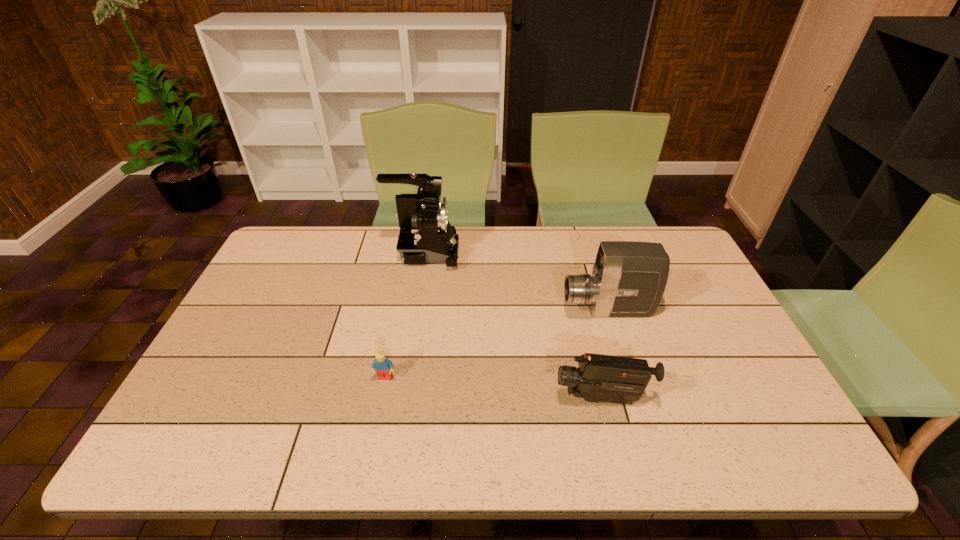
Locate an element on the screen. This screenshot has height=540, width=960. free space located 0.280m at the front of the third shortest object, highlighting the lens is located at coordinates (467, 310).

Locate an element on the screen. The height and width of the screenshot is (540, 960). free spot located 0.050m at the front of the third shortest object, highlighting the lens is located at coordinates (545, 310).

Identify the location of vacant region located 0.170m on the front-facing side of the shortest camcorder. The height and width of the screenshot is (540, 960). (485, 399).

Locate an element on the screen. free space located 0.200m on the front-facing side of the shortest camcorder is located at coordinates click(x=472, y=399).

The width and height of the screenshot is (960, 540). Find the location of `blank space located on the front-facing side of the shortest camcorder`. blank space located on the front-facing side of the shortest camcorder is located at coordinates (411, 399).

The height and width of the screenshot is (540, 960). Find the location of `free space located 0.130m on the face of the third farthest object`. free space located 0.130m on the face of the third farthest object is located at coordinates [x=374, y=429].

At what (x,y) coordinates should I click in order to perform the action: click on object that is at the far edge. Please return your answer as a coordinate pair (x, y). Image resolution: width=960 pixels, height=540 pixels. Looking at the image, I should click on (426, 236).

You are a GUI agent. You are given a task and a screenshot of the screen. Output one action in this format:
    pyautogui.click(x=<x>, y=<y>)
    Task: Click on the vacant space at the far edge
    The width and height of the screenshot is (960, 540).
    Given the screenshot: What is the action you would take?
    pyautogui.click(x=490, y=238)

Locate an element on the screen. The image size is (960, 540). free point at the near edge is located at coordinates (581, 431).

The width and height of the screenshot is (960, 540). I want to click on blank space at the left edge, so click(265, 360).